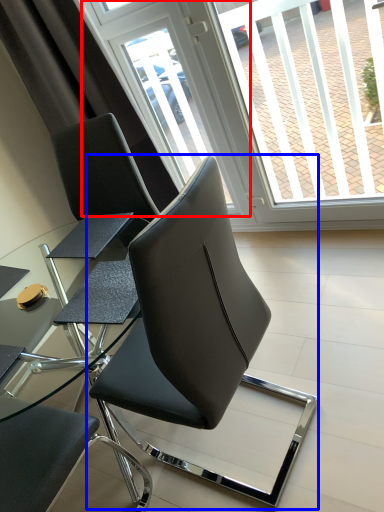
Question: Which object appears closest to the camera in this image, screen door (highlighted by a red box) or chair (highlighted by a blue box)?

Choices:
 (A) screen door
 (B) chair

Answer: (B)